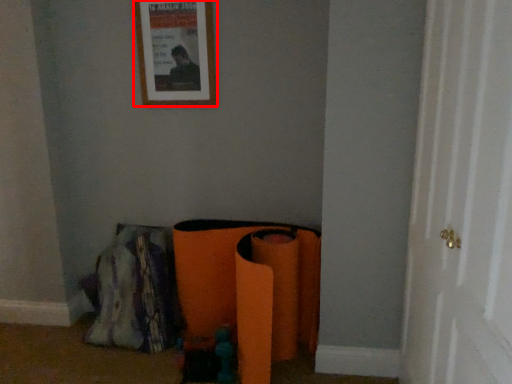
Question: From the image's perspective, where is picture frame (annotated by the red box) located relative to door?

Choices:
 (A) above
 (B) below

Answer: (A)